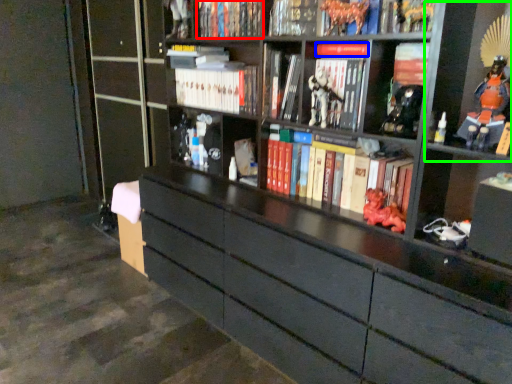
Question: Based on their relative distances, which object is farther from book (highlighted by a red box)? Choose from book (highlighted by a blue box) and cabinet (highlighted by a green box).

Choices:
 (A) book
 (B) cabinet

Answer: (B)